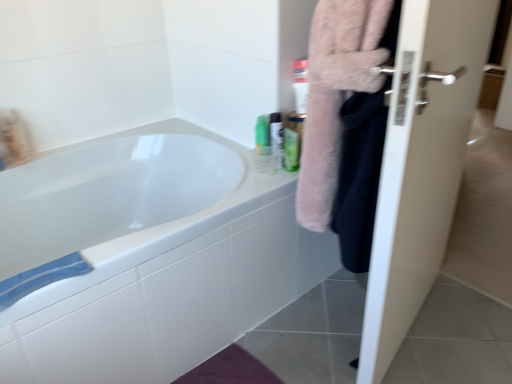
Identify the location of free point to the right of white glossy door at right. Image resolution: width=512 pixels, height=384 pixels. (467, 325).